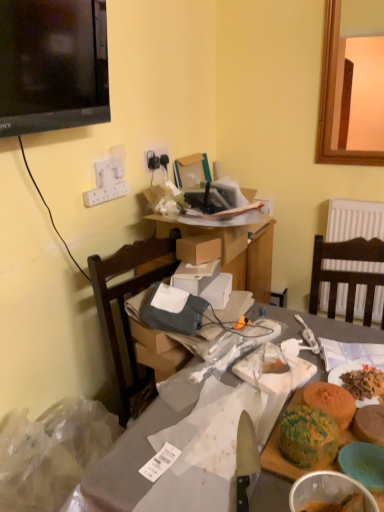
This screenshot has width=384, height=512. What do you see at coordinates (308, 437) in the screenshot?
I see `green marbled cake at center, the 3th food in the right-to-left sequence` at bounding box center [308, 437].

What is the approximate width of transparent plastic bag at lower left?

The width of transparent plastic bag at lower left is 18.80 inches.

Image resolution: width=384 pixels, height=512 pixels. What do you see at coordinates (129, 460) in the screenshot?
I see `matte gray table at center, arranged as the first table when ordered from the bottom` at bounding box center [129, 460].

Looking at this image, measure the distance between point (257, 469) and camera.

The distance of point (257, 469) from camera is 34.65 inches.

Locate an element on the screen. This screenshot has height=512, width=384. black plastic electric outlet at upper center is located at coordinates (156, 160).

I want to click on green textured cake at lower right, the third food when ordered from left to right, so click(370, 424).

Where is `green marbled cake at center, the 3th food in the right-to-left sequence`? The height and width of the screenshot is (512, 384). green marbled cake at center, the 3th food in the right-to-left sequence is located at coordinates (308, 437).

Would you say green textured cake at lower right, the third food when ordered from left to right, is inside or outside cardboard boxes at center, the 2th table positioned from the bottom?

green textured cake at lower right, the third food when ordered from left to right, exists outside the volume of cardboard boxes at center, the 2th table positioned from the bottom.

Find the location of a particular element. Image resolution: width=384 pixels, height=512 pixels. the 3rd food counting from the right of the cardboard boxes at center, the 2th table positioned from the bottom is located at coordinates (370, 424).

From the image's perspective, who appears lower, green textured cake at lower right, the third food when ordered from left to right, or cardboard boxes at center, placed as the 1th table when sorted from top to bottom?

From the image's view, green textured cake at lower right, the third food when ordered from left to right, is below.

Considering the relative positions of cardboard boxes at center, the 2th table positioned from the bottom, and matte gray table at center, arranged as the first table when ordered from the bottom, in the image provided, is cardboard boxes at center, the 2th table positioned from the bottom, to the right of matte gray table at center, arranged as the first table when ordered from the bottom, from the viewer's perspective?

In fact, cardboard boxes at center, the 2th table positioned from the bottom, is to the left of matte gray table at center, arranged as the first table when ordered from the bottom.

Is cardboard boxes at center, placed as the 1th table when sorted from top to bottom, inside the boundaries of matte gray table at center, arranged as the first table when ordered from the bottom, or outside?

cardboard boxes at center, placed as the 1th table when sorted from top to bottom, is not inside matte gray table at center, arranged as the first table when ordered from the bottom, it's outside.

From the image's perspective, which object appears higher, cardboard boxes at center, placed as the 1th table when sorted from top to bottom, or matte gray table at center, arranged as the first table when ordered from the bottom?

cardboard boxes at center, placed as the 1th table when sorted from top to bottom.

Is cardboard boxes at center, the 2th table positioned from the bottom, oriented towards matte gray table at center, placed as the second table when sorted from top to bottom?

No.

Considering the relative positions of green textured cake at lower right, the third food when ordered from left to right, and black plastic electric outlet at upper center in the image provided, is green textured cake at lower right, the third food when ordered from left to right, in front of black plastic electric outlet at upper center?

Yes, green textured cake at lower right, the third food when ordered from left to right, is in front of black plastic electric outlet at upper center.

Is green textured cake at lower right, the first food from the right, oriented away from black plastic electric outlet at upper center?

No, green textured cake at lower right, the first food from the right, is not facing away from black plastic electric outlet at upper center.

Is green textured cake at lower right, the first food from the right, thinner than black plastic electric outlet at upper center?

No, green textured cake at lower right, the first food from the right, is not thinner than black plastic electric outlet at upper center.

Between green textured cake at lower right, the first food from the right, and black plastic electric outlet at upper center, which one appears on the right side from the viewer's perspective?

Positioned to the right is green textured cake at lower right, the first food from the right.

Is green marbled cake at center, the 3th food in the right-to-left sequence, completely or partially inside green textured cake at lower right, the third food when ordered from left to right?

That's incorrect, green marbled cake at center, the 3th food in the right-to-left sequence, is not inside green textured cake at lower right, the third food when ordered from left to right.

Considering the relative positions of green textured cake at lower right, the third food when ordered from left to right, and green marbled cake at center, the 3th food in the right-to-left sequence, in the image provided, is green textured cake at lower right, the third food when ordered from left to right, to the left of green marbled cake at center, the 3th food in the right-to-left sequence, from the viewer's perspective?

Incorrect, green textured cake at lower right, the third food when ordered from left to right, is not on the left side of green marbled cake at center, the 3th food in the right-to-left sequence.

Could you tell me if green textured cake at lower right, the first food from the right, is turned towards green marbled cake at center, the 3th food in the right-to-left sequence?

No, green textured cake at lower right, the first food from the right, is not turned towards green marbled cake at center, the 3th food in the right-to-left sequence.

How many degrees apart are the facing directions of green textured cake at lower right, the third food when ordered from left to right, and green marbled cake at center, the 3th food in the right-to-left sequence?

The facing directions of green textured cake at lower right, the third food when ordered from left to right, and green marbled cake at center, the 3th food in the right-to-left sequence, are 0.00417 degrees apart.

In the image, there is a black glossy television at upper left. Where is `waste below it (from the image's perspective)`? This screenshot has width=384, height=512. waste below it (from the image's perspective) is located at coordinates tap(52, 453).

Is transparent plastic bag at lower left wider than black glossy television at upper left?

Indeed, transparent plastic bag at lower left has a greater width compared to black glossy television at upper left.

Could you tell me if transparent plastic bag at lower left is turned towards green textured cake at lower right, the first food from the right?

No, transparent plastic bag at lower left is not oriented towards green textured cake at lower right, the first food from the right.

Considering the sizes of objects transparent plastic bag at lower left and green textured cake at lower right, the first food from the right, in the image provided, who is shorter, transparent plastic bag at lower left or green textured cake at lower right, the first food from the right,?

green textured cake at lower right, the first food from the right, is shorter.

Based on the photo, are transparent plastic bag at lower left and green textured cake at lower right, the first food from the right, making contact?

transparent plastic bag at lower left and green textured cake at lower right, the first food from the right, are not in contact.

Consider the image. Between transparent plastic bag at lower left and green textured cake at lower right, the third food when ordered from left to right, which one has larger width?

Wider between the two is transparent plastic bag at lower left.

Is black glossy television at upper left a part of green textured cake at lower right, the third food when ordered from left to right?

No, black glossy television at upper left is not inside green textured cake at lower right, the third food when ordered from left to right.

Who is shorter, green textured cake at lower right, the third food when ordered from left to right, or black glossy television at upper left?

green textured cake at lower right, the third food when ordered from left to right, is shorter.

From a real-world perspective, is green textured cake at lower right, the third food when ordered from left to right, below black glossy television at upper left?

Yes, from a real-world perspective, green textured cake at lower right, the third food when ordered from left to right, is under black glossy television at upper left.

From the image's perspective, would you say green textured cake at lower right, the third food when ordered from left to right, is positioned over black glossy television at upper left?

Incorrect, from the image's perspective, green textured cake at lower right, the third food when ordered from left to right, is lower than black glossy television at upper left.

Locate an element on the screen. the 2nd table counting from the left side of the green textured cake at lower right, the first food from the right is located at coordinates (237, 251).

The width and height of the screenshot is (384, 512). Identify the location of table behind the matte gray table at center, arranged as the first table when ordered from the bottom. (237, 251).

Based on their spatial positions, is brown cardboard box at center or black plastic electric outlet at upper center further from green marbled cake at center, the 3th food in the right-to-left sequence?

black plastic electric outlet at upper center lies further to green marbled cake at center, the 3th food in the right-to-left sequence, than the other object.

Which object lies further to the anchor point transparent plastic bag at lower left, green marbled cake at center, positioned as the 1th food in left-to-right order, or cardboard boxes at center, the 2th table positioned from the bottom?

green marbled cake at center, positioned as the 1th food in left-to-right order, is further to transparent plastic bag at lower left.

Looking at the image, which one is located closer to matte gray table at center, placed as the second table when sorted from top to bottom, black plastic electric outlet at upper center or green marbled cake at center, positioned as the 1th food in left-to-right order?

The object closer to matte gray table at center, placed as the second table when sorted from top to bottom, is green marbled cake at center, positioned as the 1th food in left-to-right order.

Based on their spatial positions, is green marbled cake at center, positioned as the 1th food in left-to-right order, or black plastic electric outlet at upper center closer to green textured cake at lower right, the third food when ordered from left to right?

Based on the image, green marbled cake at center, positioned as the 1th food in left-to-right order, appears to be nearer to green textured cake at lower right, the third food when ordered from left to right.

When comparing their distances from green textured cake at lower right, the third food when ordered from left to right, does matte gray table at center, placed as the second table when sorted from top to bottom, or green textured cake at lower right, which appears as the 2th food when viewed from the right, seem closer?

Based on the image, green textured cake at lower right, which appears as the 2th food when viewed from the right, appears to be nearer to green textured cake at lower right, the third food when ordered from left to right.

Considering their positions, is black glossy television at upper left positioned closer to shiny silver knife at center than transparent plastic bag at lower left?

Among the two, transparent plastic bag at lower left is located nearer to shiny silver knife at center.

Based on their spatial positions, is green textured cake at lower right, which appears as the 2th food when viewed from the left, or black glossy television at upper left further from black plastic electric outlet at upper center?

Among the two, green textured cake at lower right, which appears as the 2th food when viewed from the left, is located further to black plastic electric outlet at upper center.

Looking at the image, which one is located closer to green textured cake at lower right, the third food when ordered from left to right, cardboard boxes at center, the 2th table positioned from the bottom, or transparent plastic bag at lower left?

Among the two, transparent plastic bag at lower left is located nearer to green textured cake at lower right, the third food when ordered from left to right.

You are a GUI agent. You are given a task and a screenshot of the screen. Output one action in this format:
    pyautogui.click(x=<x>, y=<y>)
    Task: Click on the table between black glossy television at upper left and green textured cake at lower right, the third food when ordered from left to right, in the up-down direction
    
    Given the screenshot: What is the action you would take?
    pyautogui.click(x=237, y=251)

At what (x,y) coordinates should I click in order to perform the action: click on food located between green marbled cake at center, positioned as the 1th food in left-to-right order, and green textured cake at lower right, the third food when ordered from left to right, in the left-right direction. Please return your answer as a coordinate pair (x, y). Looking at the image, I should click on (331, 401).

Identify the location of knife between transparent plastic bag at lower left and green textured cake at lower right, the third food when ordered from left to right, in the horizontal direction. The width and height of the screenshot is (384, 512). (245, 459).

Identify the location of food between green textured cake at lower right, the first food from the right, and matte gray table at center, placed as the second table when sorted from top to bottom, from top to bottom. This screenshot has height=512, width=384. (308, 437).